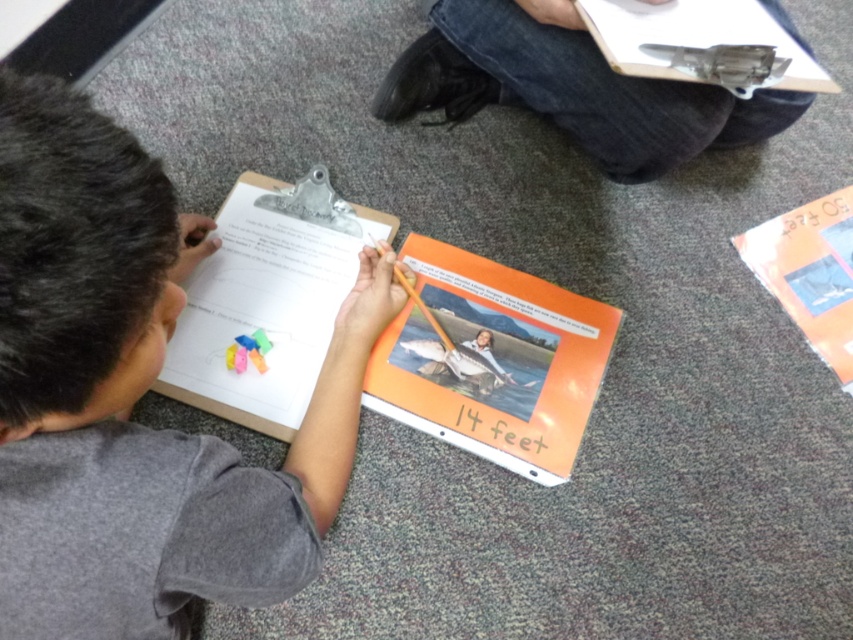
Which is below, gray matte shirt at upper left or green matte text at center?

green matte text at center is lower down.

Who is shorter, gray matte shirt at upper left or green matte text at center?

green matte text at center is shorter.

Is point (178, 637) more distant than point (467, 406)?

No, (178, 637) is closer to viewer.

This screenshot has width=853, height=640. I want to click on gray matte shirt at upper left, so click(136, 396).

Which is above, gray matte shirt at upper left or orange matte book at center?

orange matte book at center is above.

Can you confirm if gray matte shirt at upper left is positioned to the left of orange matte book at center?

Yes, gray matte shirt at upper left is to the left of orange matte book at center.

You are a GUI agent. You are given a task and a screenshot of the screen. Output one action in this format:
    pyautogui.click(x=<x>, y=<y>)
    Task: Click on the gray matte shirt at upper left
    The width and height of the screenshot is (853, 640).
    Given the screenshot: What is the action you would take?
    pyautogui.click(x=136, y=396)

At what (x,y) coordinates should I click in order to perform the action: click on gray matte shirt at upper left. Please return your answer as a coordinate pair (x, y). Looking at the image, I should click on (136, 396).

Which is more to the right, gray matte shirt at upper left or metallic gray book at upper center?

From the viewer's perspective, metallic gray book at upper center appears more on the right side.

Does gray matte shirt at upper left appear over metallic gray book at upper center?

No.

Is point (314, 560) positioned before point (717, 36)?

Yes, it is in front of point (717, 36).

This screenshot has height=640, width=853. Find the location of `gray matte shirt at upper left`. gray matte shirt at upper left is located at coordinates pos(136,396).